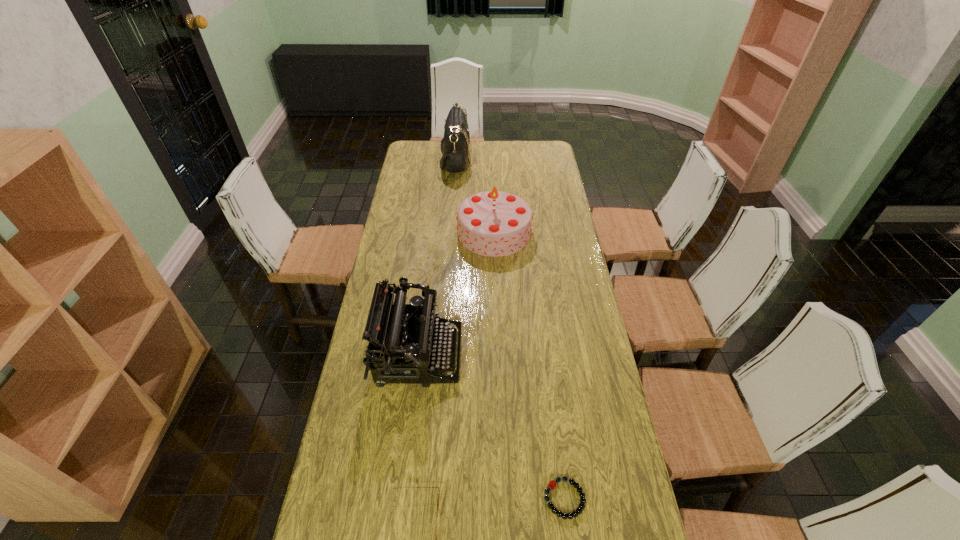
Where is `the farthest object`? The height and width of the screenshot is (540, 960). the farthest object is located at coordinates (455, 145).

Where is `the fourth nearest object`? The width and height of the screenshot is (960, 540). the fourth nearest object is located at coordinates (493, 223).

The height and width of the screenshot is (540, 960). Find the location of `typewriter`. typewriter is located at coordinates (411, 349).

Identify the location of the shortest object. The image size is (960, 540). (552, 484).

The width and height of the screenshot is (960, 540). Identify the location of vacant space positioned at the front of the handbag with chain and zipper. (484, 159).

The width and height of the screenshot is (960, 540). I want to click on vacant region located 0.060m on the front of the birthday cake, so click(x=495, y=268).

I want to click on free location located 0.300m on the keyboard of the third farthest object, so click(556, 355).

Where is `vacant space located on the back of the bracelet`? vacant space located on the back of the bracelet is located at coordinates (556, 433).

Where is `object at the far edge`? This screenshot has height=540, width=960. object at the far edge is located at coordinates (455, 145).

I want to click on object that is at the left edge, so click(411, 349).